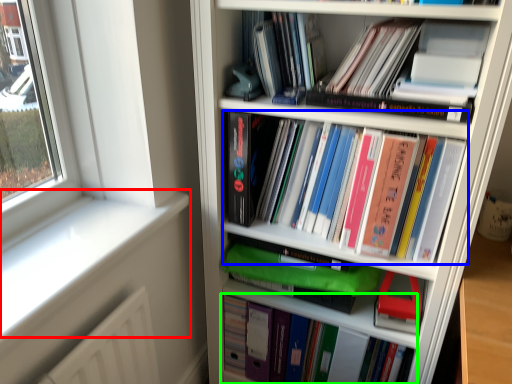
Question: Based on their relative distances, which object is farther from window sill (highlighted by a red box)? Choose from book (highlighted by a blue box) and book (highlighted by a green box).

Choices:
 (A) book
 (B) book

Answer: (B)